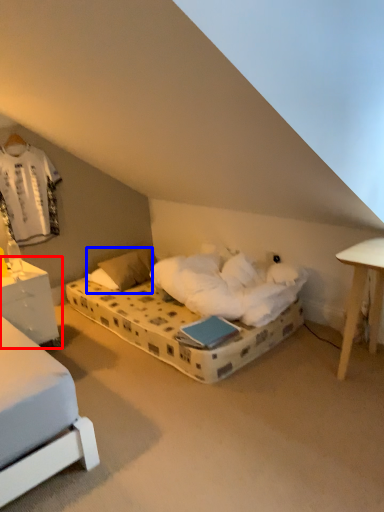
Question: Which object appears farthest to the camera in this image, nightstand (highlighted by a red box) or pillow (highlighted by a blue box)?

Choices:
 (A) nightstand
 (B) pillow

Answer: (B)